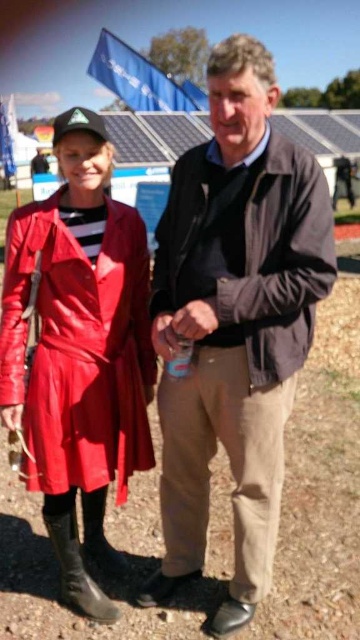
You are a photographer trying to capture a clear shot of the matte leather coat at left without the dirt field at center showing in the background. Can you adjust your camera angle to achieve this?

The matte leather coat at left is positioned over dirt field at center, so adjusting the camera angle to focus on the matte leather coat at left while tilting the camera slightly upward might help avoid showing the dirt field at center in the background.

You are a photographer trying to capture both the brown leather jacket at center and the black leather boot at lower left in a single frame. Considering their heights, which object will appear larger in the photo?

The brown leather jacket at center will appear larger in the photo since it is much taller than the black leather boot at lower left.